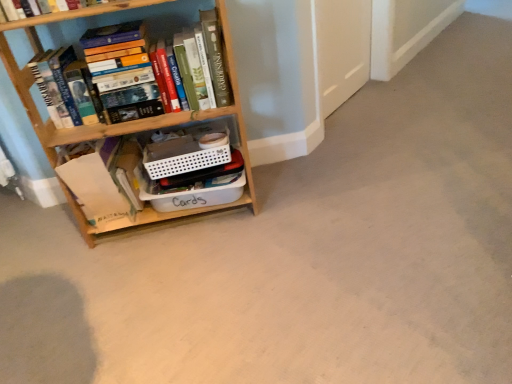
In order to click on free region on the left part of wooden bookcase at left in this screenshot , I will do `click(47, 254)`.